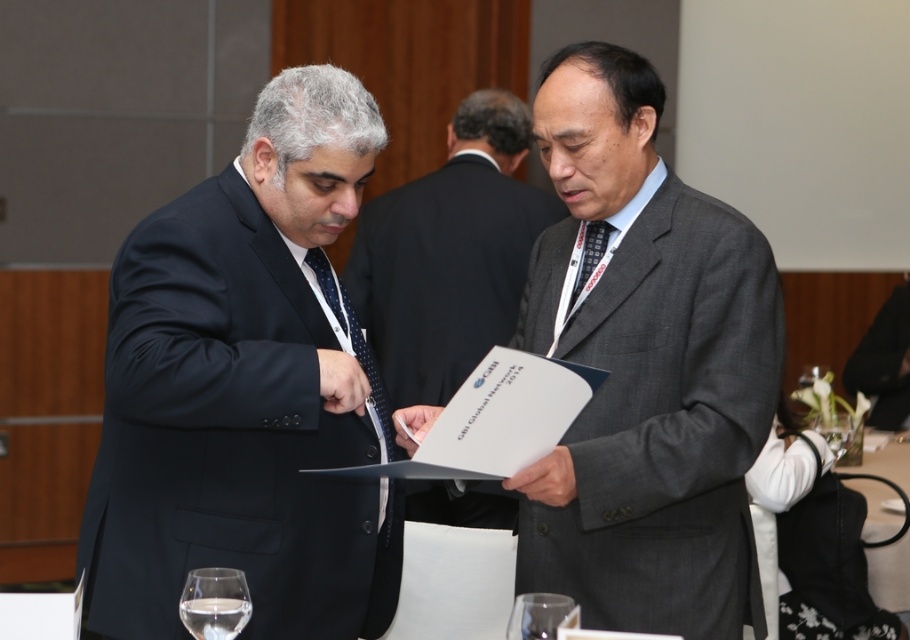
Is black fabric business suit at lower right to the right of clear glass wine glass at lower center from the viewer's perspective?

Yes, black fabric business suit at lower right is to the right of clear glass wine glass at lower center.

Between point (906, 323) and point (846, 448), which one is positioned behind?

The point (906, 323) is behind.

What do you see at coordinates (885, 362) in the screenshot?
I see `black fabric business suit at lower right` at bounding box center [885, 362].

Where is `black fabric business suit at lower right`? The image size is (910, 640). black fabric business suit at lower right is located at coordinates (885, 362).

Which of these two, matte black suit at left or gray textured suit at center, stands taller?

Standing taller between the two is gray textured suit at center.

Between point (135, 304) and point (632, 513), which one is positioned behind?

The point (632, 513) is behind.

Who is more forward, (x=314, y=401) or (x=743, y=396)?

Positioned in front is point (x=314, y=401).

I want to click on matte black suit at left, so click(246, 388).

Does gray textured suit at center have a smaller size compared to matte gray suit at center?

Yes, gray textured suit at center is smaller than matte gray suit at center.

Is gray textured suit at center taller than matte gray suit at center?

Yes.

At what (x,y) coordinates should I click in order to perform the action: click on gray textured suit at center. Please return your answer as a coordinate pair (x, y). Looking at the image, I should click on (644, 368).

I want to click on gray textured suit at center, so click(644, 368).